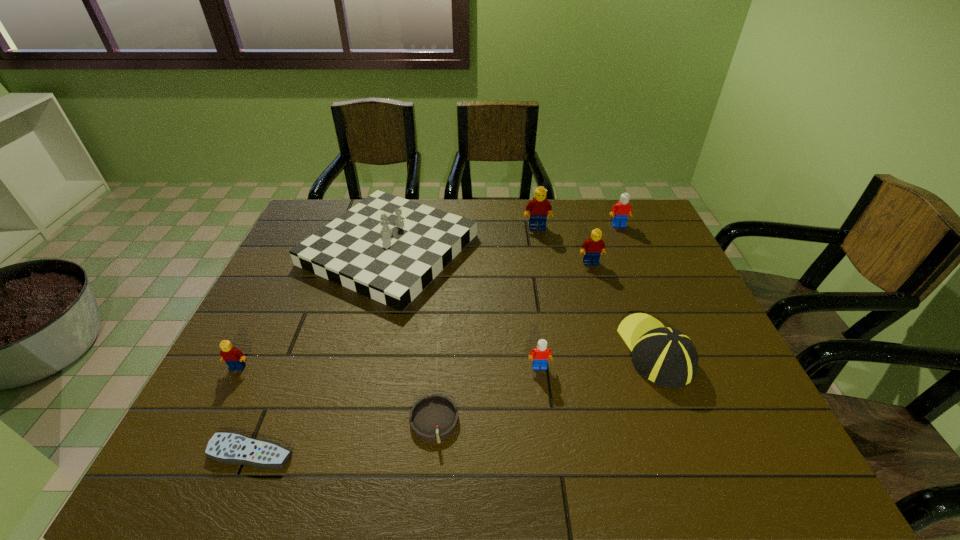
The height and width of the screenshot is (540, 960). Find the location of `Lego that is at the left edge`. Lego that is at the left edge is located at coordinates (233, 357).

This screenshot has width=960, height=540. I want to click on remote control located in the left edge section of the desktop, so click(x=226, y=447).

Image resolution: width=960 pixels, height=540 pixels. I want to click on Lego situated at the right edge, so click(622, 210).

You are a GUI agent. You are given a task and a screenshot of the screen. Output one action in this format:
    pyautogui.click(x=<x>, y=<y>)
    Task: Click on the baseball cap located in the right edge section of the desktop
    
    Given the screenshot: What is the action you would take?
    pyautogui.click(x=665, y=356)

Where is `object located at the far left corner`? The width and height of the screenshot is (960, 540). object located at the far left corner is located at coordinates (387, 248).

The height and width of the screenshot is (540, 960). Find the location of `object located in the near left corner section of the desktop`. object located in the near left corner section of the desktop is located at coordinates (226, 447).

Locate an element on the screen. This screenshot has width=960, height=540. object located in the far right corner section of the desktop is located at coordinates (622, 210).

In the image, there is a desktop. Where is `free space at the far edge`? This screenshot has height=540, width=960. free space at the far edge is located at coordinates (423, 204).

You are a GUI agent. You are given a task and a screenshot of the screen. Output one action in this format:
    pyautogui.click(x=<x>, y=<y>)
    Task: Click on the vacant space at the near edge of the desktop
    The width and height of the screenshot is (960, 540).
    Given the screenshot: What is the action you would take?
    pyautogui.click(x=348, y=461)

Where is `free region at the left edge of the desktop`? This screenshot has height=540, width=960. free region at the left edge of the desktop is located at coordinates (311, 299).